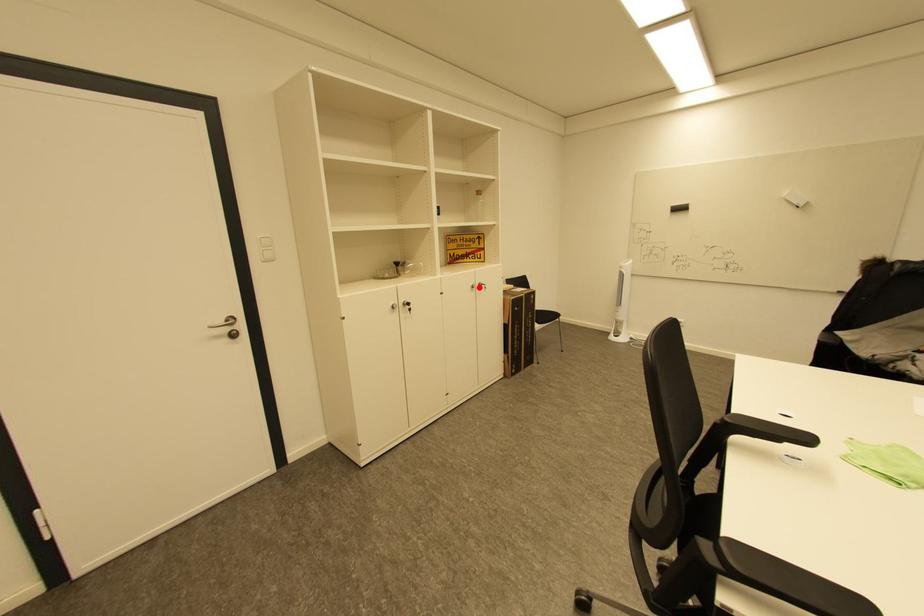
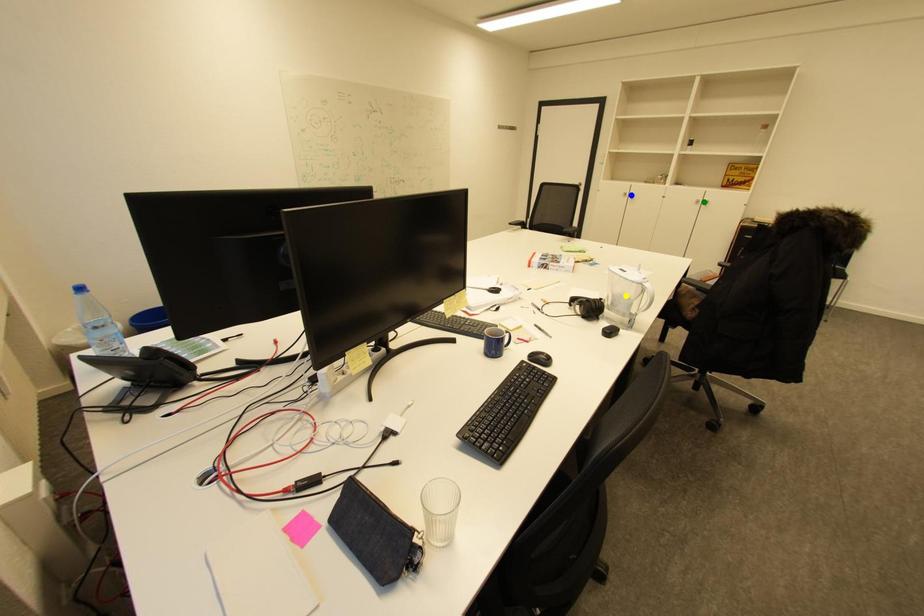
Question: I am providing you with two images of the same scene from different viewpoints. A red point is marked on the first image. You are given multiple points on the second image. Which spot in image 2 lines up with the point in image 1?

Choices:
 (A) yellow point
 (B) green point
 (C) blue point

Answer: (B)